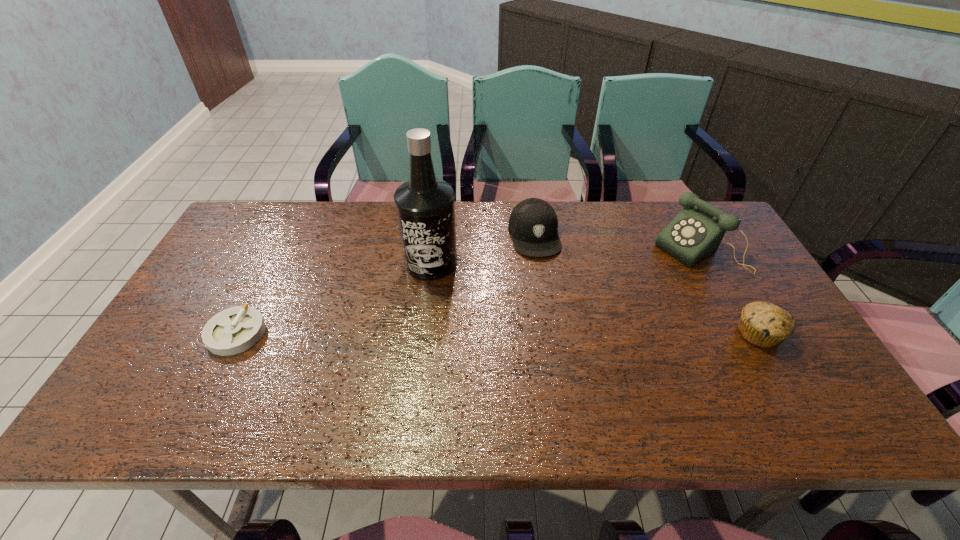
What are the coordinates of `telephone that is at the far edge` in the screenshot? It's located at (695, 233).

I want to click on object located at the left edge, so click(x=234, y=330).

The image size is (960, 540). Identify the location of muffin located at the right edge. (763, 324).

At what (x,y) coordinates should I click in order to perform the action: click on telephone located at the right edge. Please return your answer as a coordinate pair (x, y). Looking at the image, I should click on pyautogui.click(x=695, y=233).

Find the location of a particular element. The image size is (960, 540). object located at the far right corner is located at coordinates (695, 233).

You are a GUI agent. You are given a task and a screenshot of the screen. Output one action in this format:
    pyautogui.click(x=<x>, y=<y>)
    Task: Click on the free location at the far edge
    The image size is (960, 540).
    Given the screenshot: What is the action you would take?
    pyautogui.click(x=383, y=245)

Find the location of a particular element. free space at the near edge of the desktop is located at coordinates (740, 368).

The width and height of the screenshot is (960, 540). In the image, there is a desktop. Identify the location of free space at the left edge. (163, 353).

Identify the location of vacant region at the right edge. (726, 251).

In the image, there is a desktop. Identify the location of vacant space at the far left corner. (273, 213).